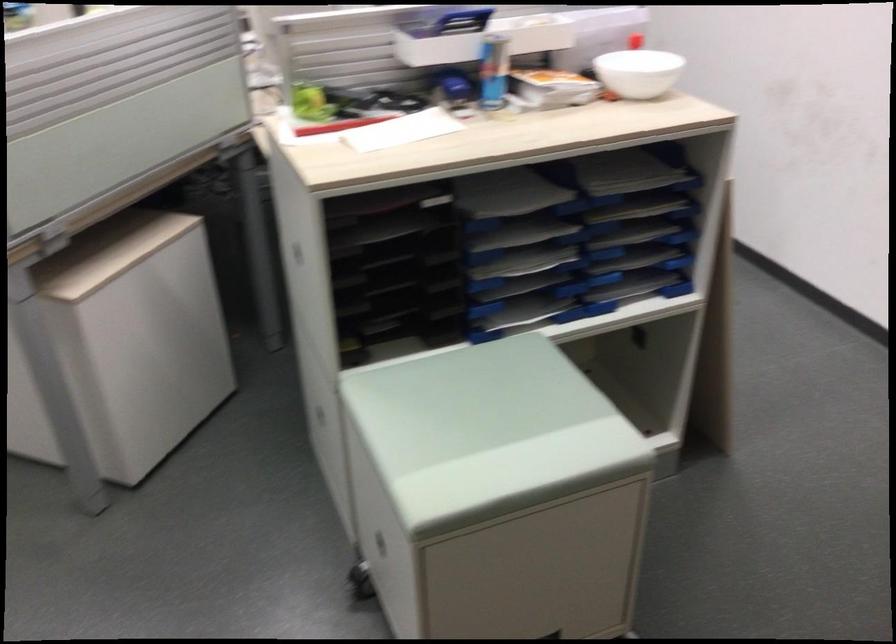
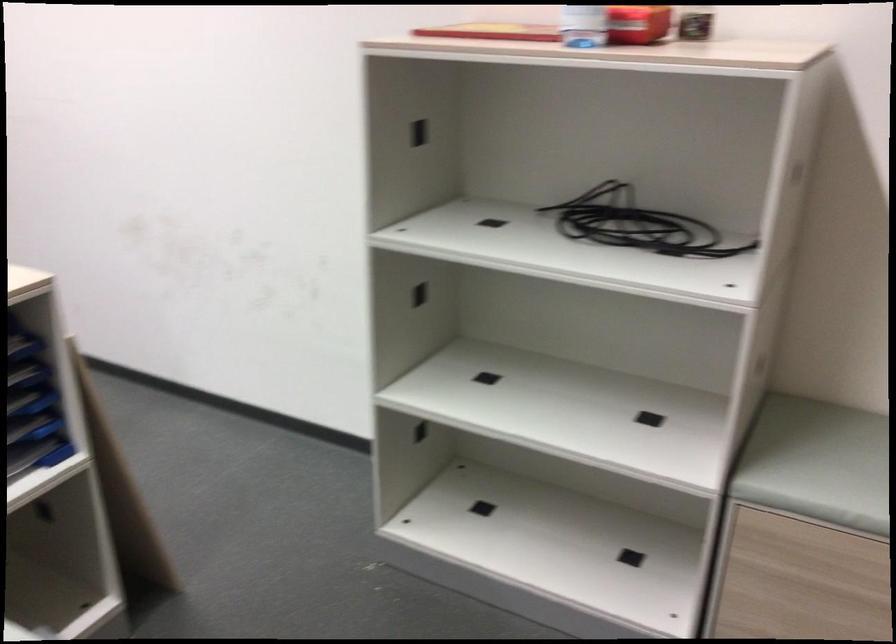
Question: Based on the continuous images, in which direction is the camera rotating? Reply with the corresponding letter.

Choices:
 (A) Left
 (B) Right
 (C) Up
 (D) Down

Answer: (B)